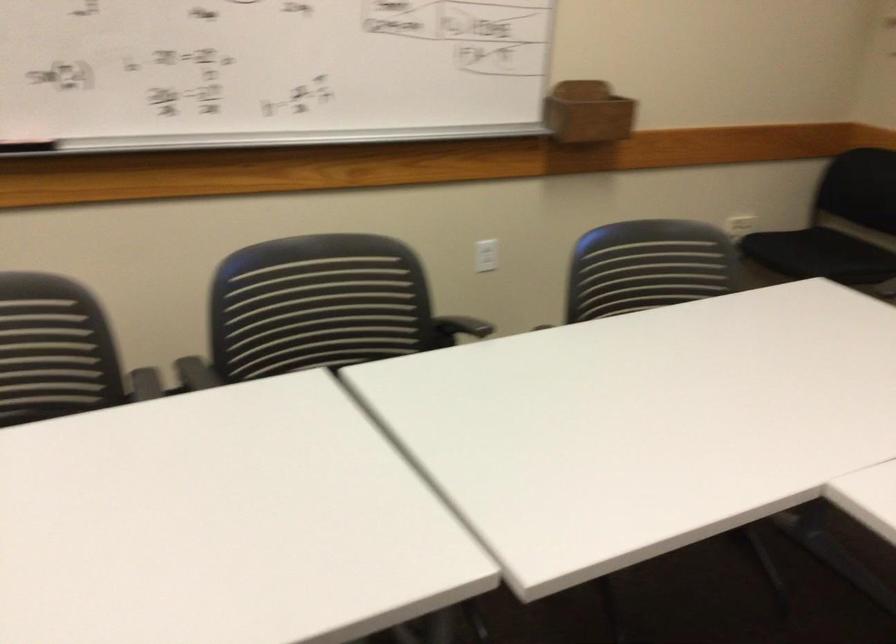
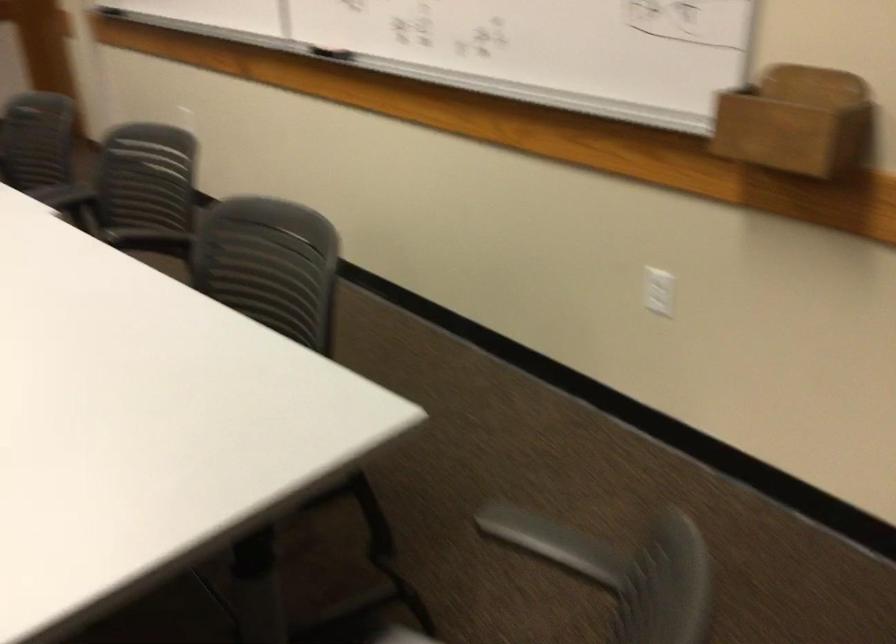
In the second image, find the point that corresponds to point 588,306 in the first image.

(270, 289)